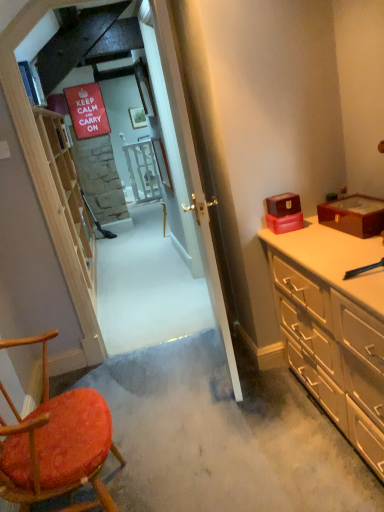
What is the approximate width of light wood shelf at left?

It is 12.62 inches.

The width and height of the screenshot is (384, 512). What do you see at coordinates (56, 444) in the screenshot?
I see `wooden textured chair at lower left` at bounding box center [56, 444].

This screenshot has height=512, width=384. I want to click on shiny burgundy box at right, acting as the 1th box starting from the right, so (x=353, y=215).

In order to face shiny burgundy box at right, which appears as the second box when viewed from the left, should I rotate leftwards or rightwards?

It's best to rotate right around 21.162 degrees.

The image size is (384, 512). Describe the element at coordinates (284, 213) in the screenshot. I see `matte red box at right, the 1th box when ordered from left to right` at that location.

At what (x,y) coordinates should I click in order to perform the action: click on light wood shelf at left. Please return your answer as a coordinate pair (x, y). This screenshot has width=384, height=512. Looking at the image, I should click on (67, 190).

From the image's perspective, is wooden textured chair at lower left over beige wood dresser at right?

Actually, wooden textured chair at lower left appears below beige wood dresser at right in the image.

Based on the photo, relative to beige wood dresser at right, is wooden textured chair at lower left in front or behind?

In the image, wooden textured chair at lower left appears in front of beige wood dresser at right.

Would you say wooden textured chair at lower left is outside beige wood dresser at right?

Yes, wooden textured chair at lower left is located beyond the bounds of beige wood dresser at right.

Between wooden textured chair at lower left and beige wood dresser at right, which one appears on the left side from the viewer's perspective?

From the viewer's perspective, wooden textured chair at lower left appears more on the left side.

In order to click on shelf on the left of wooden textured chair at lower left in this screenshot , I will do [67, 190].

Is light wood shelf at left facing away from wooden textured chair at lower left?

light wood shelf at left is not turned away from wooden textured chair at lower left.

Does point (295, 219) come behind point (377, 356)?

Yes, point (295, 219) is farther from viewer.

Measure the distance between matte red box at right, the second box in the right-to-left sequence, and beige wood dresser at right.

matte red box at right, the second box in the right-to-left sequence, is 17.35 inches away from beige wood dresser at right.

Considering the sizes of objects matte red box at right, the second box in the right-to-left sequence, and beige wood dresser at right in the image provided, who is bigger, matte red box at right, the second box in the right-to-left sequence, or beige wood dresser at right?

Bigger between the two is beige wood dresser at right.

Is beige wood dresser at right at the back of matte red box at right, the 1th box when ordered from left to right?

No, matte red box at right, the 1th box when ordered from left to right, is not facing the opposite direction of beige wood dresser at right.

From a real-world perspective, between beige wood dresser at right and matte red box at right, the second box in the right-to-left sequence, who is vertically higher?

matte red box at right, the second box in the right-to-left sequence, is physically above.

Identify the location of the 1st box above the beige wood dresser at right (from a real-world perspective). The height and width of the screenshot is (512, 384). (284, 213).

What's the angular difference between beige wood dresser at right and matte red box at right, the 1th box when ordered from left to right,'s facing directions?

The angle between the facing direction of beige wood dresser at right and the facing direction of matte red box at right, the 1th box when ordered from left to right, is 85.6 degrees.

Does beige wood dresser at right have a greater width compared to matte red box at right, the second box in the right-to-left sequence?

Indeed, beige wood dresser at right has a greater width compared to matte red box at right, the second box in the right-to-left sequence.

From the image's perspective, is light wood shelf at left under shiny burgundy box at right, acting as the 1th box starting from the right?

No, from the image's perspective, light wood shelf at left is not below shiny burgundy box at right, acting as the 1th box starting from the right.

Considering the sizes of objects light wood shelf at left and shiny burgundy box at right, which appears as the second box when viewed from the left, in the image provided, who is bigger, light wood shelf at left or shiny burgundy box at right, which appears as the second box when viewed from the left,?

With larger size is light wood shelf at left.

Would you say light wood shelf at left is inside or outside shiny burgundy box at right, which appears as the second box when viewed from the left?

The correct answer is: outside.

The width and height of the screenshot is (384, 512). I want to click on shelf behind the shiny burgundy box at right, which appears as the second box when viewed from the left, so click(67, 190).

Who is taller, matte red box at right, the 1th box when ordered from left to right, or wooden textured chair at lower left?

Standing taller between the two is wooden textured chair at lower left.

Consider the image. Is matte red box at right, the 1th box when ordered from left to right, completely or partially outside of wooden textured chair at lower left?

matte red box at right, the 1th box when ordered from left to right, lies outside wooden textured chair at lower left's area.

Looking at this image, is wooden textured chair at lower left at the back of matte red box at right, the second box in the right-to-left sequence?

No, wooden textured chair at lower left is not at the back of matte red box at right, the second box in the right-to-left sequence.

Locate an element on the screen. The width and height of the screenshot is (384, 512). shelf behind the beige wood dresser at right is located at coordinates (67, 190).

From the image's perspective, would you say beige wood dresser at right is positioned over light wood shelf at left?

No, from the image's perspective, beige wood dresser at right is not over light wood shelf at left.

From a real-world perspective, is beige wood dresser at right on top of light wood shelf at left?

Incorrect, from a real-world perspective, beige wood dresser at right is lower than light wood shelf at left.

Who is bigger, beige wood dresser at right or light wood shelf at left?

With larger size is light wood shelf at left.

Locate an element on the screen. The height and width of the screenshot is (512, 384). cabinetry that is behind the wooden textured chair at lower left is located at coordinates (334, 327).

Locate an element on the screen. The image size is (384, 512). shelf on the left of the wooden textured chair at lower left is located at coordinates (67, 190).

From the image, which object appears to be nearer to shiny burgundy box at right, which appears as the second box when viewed from the left, matte red box at right, the 1th box when ordered from left to right, or wooden textured chair at lower left?

The object closer to shiny burgundy box at right, which appears as the second box when viewed from the left, is matte red box at right, the 1th box when ordered from left to right.

Which object lies further to the anchor point light wood shelf at left, shiny burgundy box at right, acting as the 1th box starting from the right, or matte red box at right, the 1th box when ordered from left to right?

shiny burgundy box at right, acting as the 1th box starting from the right, is further to light wood shelf at left.

When comparing their distances from beige wood dresser at right, does shiny burgundy box at right, acting as the 1th box starting from the right, or wooden textured chair at lower left seem further?

wooden textured chair at lower left lies further to beige wood dresser at right than the other object.

From the image, which object appears to be nearer to beige wood dresser at right, light wood shelf at left or shiny burgundy box at right, acting as the 1th box starting from the right?

shiny burgundy box at right, acting as the 1th box starting from the right, is closer to beige wood dresser at right.

Considering their positions, is beige wood dresser at right positioned further to shiny burgundy box at right, acting as the 1th box starting from the right, than wooden textured chair at lower left?

wooden textured chair at lower left.

Looking at the image, which one is located closer to light wood shelf at left, beige wood dresser at right or matte red box at right, the 1th box when ordered from left to right?

beige wood dresser at right is positioned closer to the anchor light wood shelf at left.

Which object lies nearer to the anchor point matte red box at right, the 1th box when ordered from left to right, beige wood dresser at right or shiny burgundy box at right, which appears as the second box when viewed from the left?

shiny burgundy box at right, which appears as the second box when viewed from the left, lies closer to matte red box at right, the 1th box when ordered from left to right, than the other object.

Based on the photo, considering their positions, is beige wood dresser at right positioned further to light wood shelf at left than wooden textured chair at lower left?

The object further to light wood shelf at left is beige wood dresser at right.

The width and height of the screenshot is (384, 512). I want to click on chair situated between light wood shelf at left and beige wood dresser at right from left to right, so click(56, 444).

Where is `box located between wooden textured chair at lower left and shiny burgundy box at right, acting as the 1th box starting from the right, in the left-right direction`? This screenshot has width=384, height=512. box located between wooden textured chair at lower left and shiny burgundy box at right, acting as the 1th box starting from the right, in the left-right direction is located at coordinates (284, 213).

You are a GUI agent. You are given a task and a screenshot of the screen. Output one action in this format:
    pyautogui.click(x=<x>, y=<y>)
    Task: Click on the box situated between light wood shelf at left and shiny burgundy box at right, acting as the 1th box starting from the right, from left to right
    Image resolution: width=384 pixels, height=512 pixels.
    Given the screenshot: What is the action you would take?
    pyautogui.click(x=284, y=213)

I want to click on chair located between light wood shelf at left and matte red box at right, the 1th box when ordered from left to right, in the left-right direction, so click(56, 444).